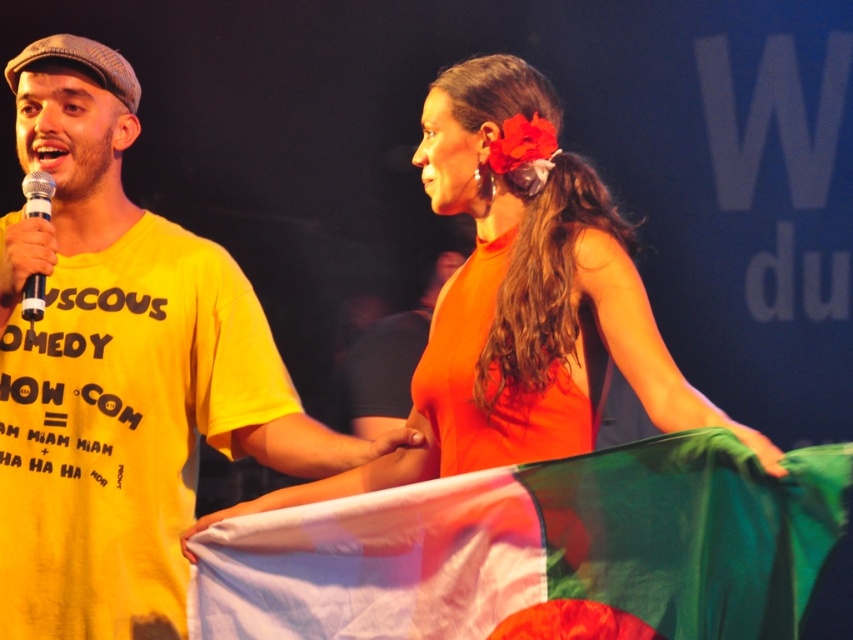
Based on the photo, you are a stagehand setting up for a performance. You have an orange fabric at center and a silver metallic microphone at left. Which object requires more space to store?

The orange fabric at center requires more space to store because it is larger in size than the silver metallic microphone at left.

Based on the photo, you are a photographer trying to capture a photo of the orange fabric at center and the silver metallic microphone at left. Which object should you focus on first if you want to include both in your shot without moving the camera?

The orange fabric at center is to the right of the silver metallic microphone at left, so you should focus on the silver metallic microphone at left first to ensure both objects are within the frame.